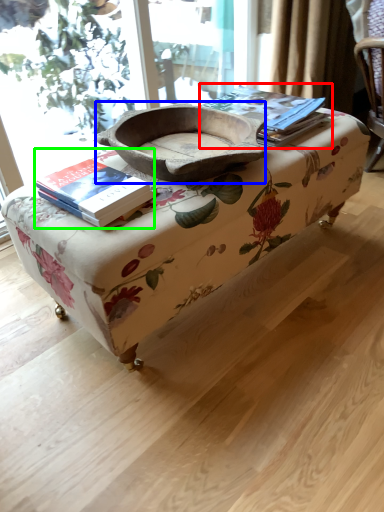
Question: Which is farther away from paperback book (highlighted by a red box)? bowl (highlighted by a blue box) or book (highlighted by a green box)?

Choices:
 (A) bowl
 (B) book

Answer: (B)